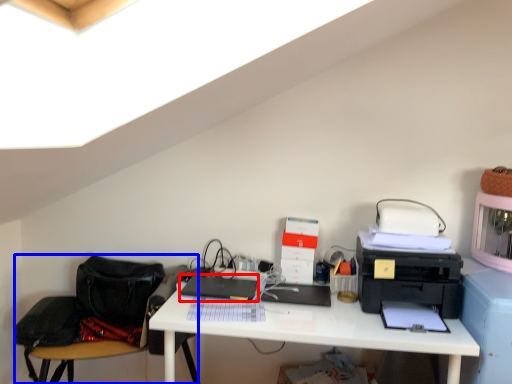
Question: Which of the following is the farthest to the observer, laptop (highlighted by a red box) or swivel chair (highlighted by a blue box)?

Choices:
 (A) laptop
 (B) swivel chair

Answer: (A)